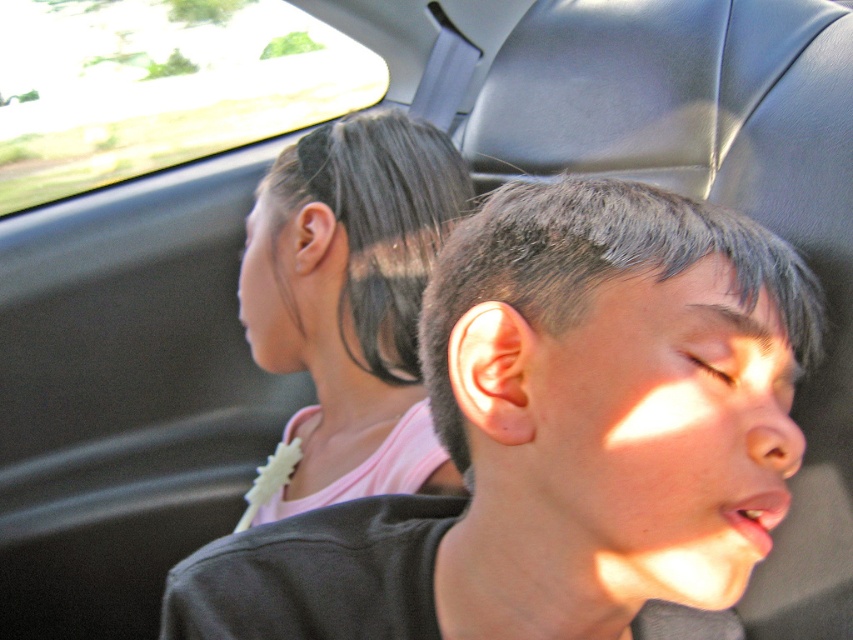
You are a photographer standing 1.2 meters away from the camera. You want to take a photo of the scene but need to adjust your position so that you are exactly 1.11 meters away from the point at coordinates point (384, 282). Is your current position sufficient for this requirement?

The point (384, 282) and camera are 1.11 meters apart from each other. Since you are currently 1.2 meters away from the camera, you are slightly farther than the required distance to the point. Move 0.09 meters closer to the camera to achieve the exact 1.11 meters distance from the point.

You are a photographer trying to capture a closeup of the smooth pink shirt at left and the transparent glass car window at upper left. Which object will appear smaller in your photo?

The smooth pink shirt at left will appear smaller in the photo because it has a lesser width compared to the transparent glass car window at upper left.

You are a passenger in the car and want to look outside through the transparent glass car window at upper left. However, the smooth pink shirt at left is blocking your view. Can you tell me which one is taller so you can decide whether to move the shirt or lower your head?

The smooth pink shirt at left is not as tall as the transparent glass car window at upper left, so you can lower your head slightly to look over the smooth pink shirt at left and see through the transparent glass car window at upper left.